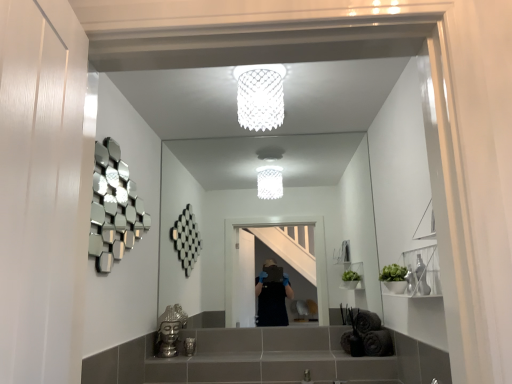
Find the location of a particular element. The height and width of the screenshot is (384, 512). blank space above clear glass mirror at center (from a real-world perspective) is located at coordinates (264, 130).